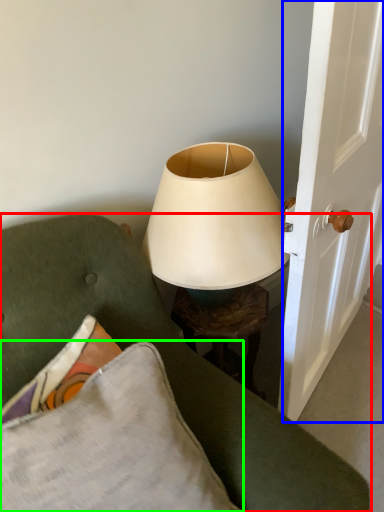
Question: Which object is the closest to the furniture (highlighted by a red box)? Choose among these: screen door (highlighted by a blue box) or pillow (highlighted by a green box).

Choices:
 (A) screen door
 (B) pillow

Answer: (B)